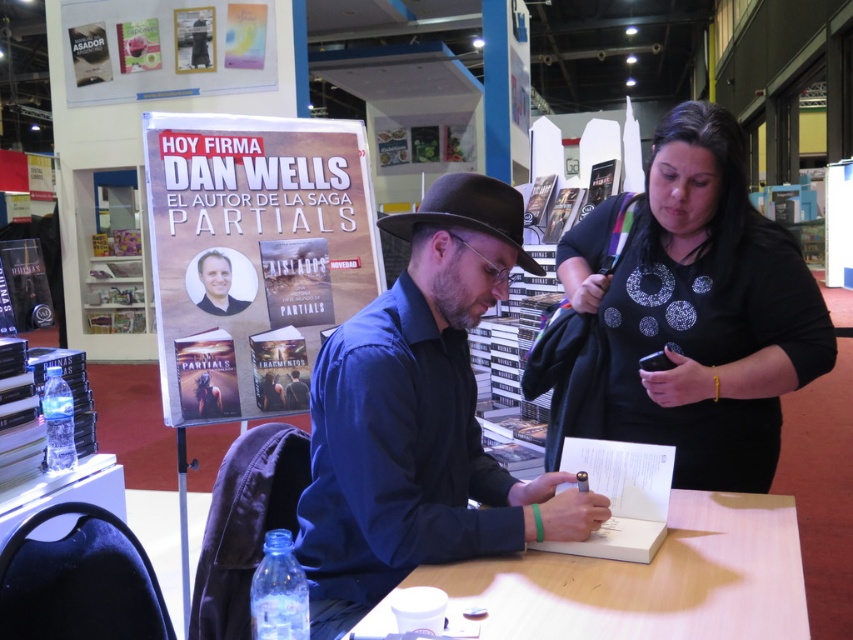
Which is in front, point (351, 470) or point (544, 604)?

Point (544, 604) is in front.

Who is more distant from viewer, (380, 388) or (780, 592)?

Positioned behind is point (380, 388).

I want to click on blue cotton shirt at center, so click(x=419, y=419).

Does blue cotton shirt at center lie behind white paper poster at center?

No.

Does point (321, 499) come in front of point (329, 301)?

Yes, it is.

In the scene shown: Who is more distant from viewer, (450, 225) or (258, 179)?

Positioned behind is point (258, 179).

Find the location of a particular element. blue cotton shirt at center is located at coordinates (419, 419).

You are a GUI agent. You are given a task and a screenshot of the screen. Output one action in this format:
    pyautogui.click(x=<x>, y=<y>)
    Task: Click on the white paper poster at center
    
    Given the screenshot: What is the action you would take?
    pyautogui.click(x=253, y=256)

Is white paper poster at center shorter than light brown wooden table at center?

In fact, white paper poster at center may be taller than light brown wooden table at center.

Which is behind, point (309, 369) or point (759, 566)?

Point (309, 369)

Locate an element on the screen. The width and height of the screenshot is (853, 640). white paper poster at center is located at coordinates (253, 256).